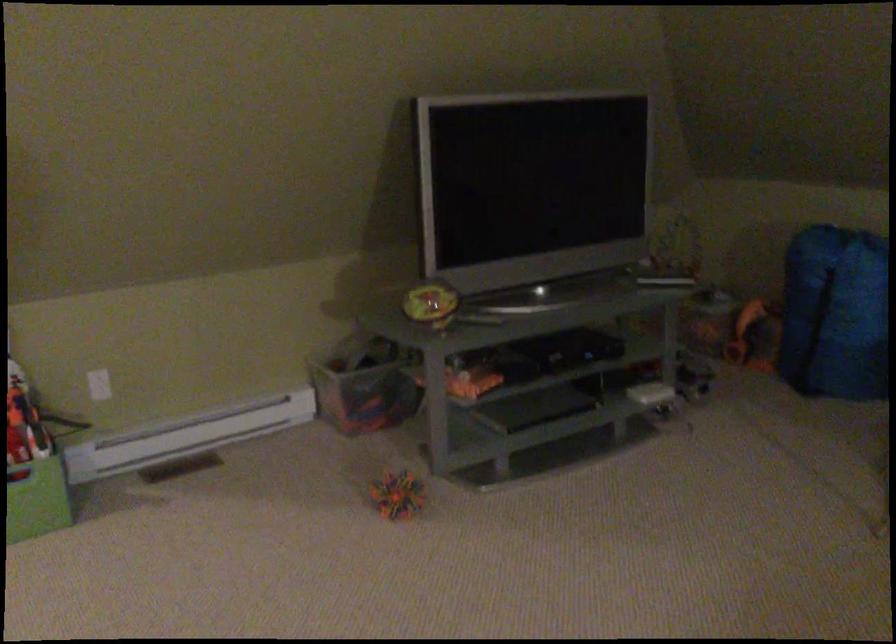
Locate an element on the screen. The height and width of the screenshot is (644, 896). white light switch is located at coordinates (99, 384).